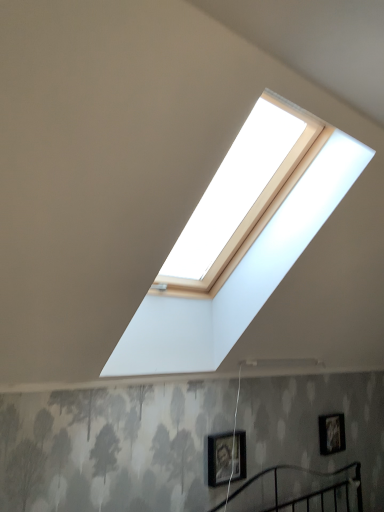
Question: From a real-world perspective, is matte black picture frame at lower right, marked as the second picture frame in a front-to-back arrangement, below matte black picture frame at lower center, which appears as the 1th picture frame when viewed from the left?

Choices:
 (A) no
 (B) yes

Answer: (A)

Question: Is matte black picture frame at lower right, placed as the second picture frame when sorted from left to right, outside matte black picture frame at lower center, which appears as the 1th picture frame when viewed from the left?

Choices:
 (A) no
 (B) yes

Answer: (B)

Question: Is matte black picture frame at lower right, marked as the second picture frame in a front-to-back arrangement, further to the viewer compared to matte black picture frame at lower center, the second picture frame when ordered from right to left?

Choices:
 (A) no
 (B) yes

Answer: (B)

Question: Does matte black picture frame at lower right, marked as the second picture frame in a front-to-back arrangement, have a lesser width compared to matte black picture frame at lower center, the second picture frame when ordered from right to left?

Choices:
 (A) yes
 (B) no

Answer: (A)

Question: Could you tell me if matte black picture frame at lower right, placed as the second picture frame when sorted from left to right, is turned towards matte black picture frame at lower center, which appears as the first picture frame when viewed from the front?

Choices:
 (A) no
 (B) yes

Answer: (A)

Question: Does matte black picture frame at lower right, the first picture frame viewed from the back, lie in front of matte black picture frame at lower center, the second picture frame when ordered from right to left?

Choices:
 (A) yes
 (B) no

Answer: (B)

Question: Does matte black picture frame at lower center, which appears as the 1th picture frame when viewed from the left, appear on the left side of matte black picture frame at lower right, the first picture frame viewed from the back?

Choices:
 (A) no
 (B) yes

Answer: (B)

Question: From a real-world perspective, does matte black picture frame at lower center, which appears as the first picture frame when viewed from the front, sit lower than matte black picture frame at lower right, the first picture frame viewed from the back?

Choices:
 (A) no
 (B) yes

Answer: (B)

Question: Considering the relative sizes of matte black picture frame at lower center, the second picture frame when ordered from right to left, and matte black picture frame at lower right, placed as the second picture frame when sorted from left to right, in the image provided, is matte black picture frame at lower center, the second picture frame when ordered from right to left, taller than matte black picture frame at lower right, placed as the second picture frame when sorted from left to right,?

Choices:
 (A) yes
 (B) no

Answer: (B)

Question: From the image's perspective, is matte black picture frame at lower center, which appears as the 1th picture frame when viewed from the left, beneath matte black picture frame at lower right, marked as the second picture frame in a front-to-back arrangement?

Choices:
 (A) no
 (B) yes

Answer: (A)

Question: Considering the relative sizes of matte black picture frame at lower center, the 2th picture frame when ordered from back to front, and matte black picture frame at lower right, which is the 1th picture frame from right to left, in the image provided, is matte black picture frame at lower center, the 2th picture frame when ordered from back to front, wider than matte black picture frame at lower right, which is the 1th picture frame from right to left,?

Choices:
 (A) no
 (B) yes

Answer: (B)

Question: Does matte black picture frame at lower center, which appears as the first picture frame when viewed from the front, come in front of matte black picture frame at lower right, marked as the second picture frame in a front-to-back arrangement?

Choices:
 (A) no
 (B) yes

Answer: (B)

Question: Is point (322, 440) positioned closer to the camera than point (226, 442)?

Choices:
 (A) closer
 (B) farther

Answer: (B)